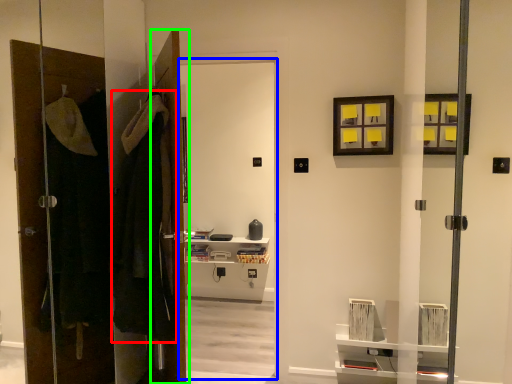
Question: Which is farther away from robe (highlighted by a red box)? screen door (highlighted by a blue box) or door (highlighted by a green box)?

Choices:
 (A) screen door
 (B) door

Answer: (A)